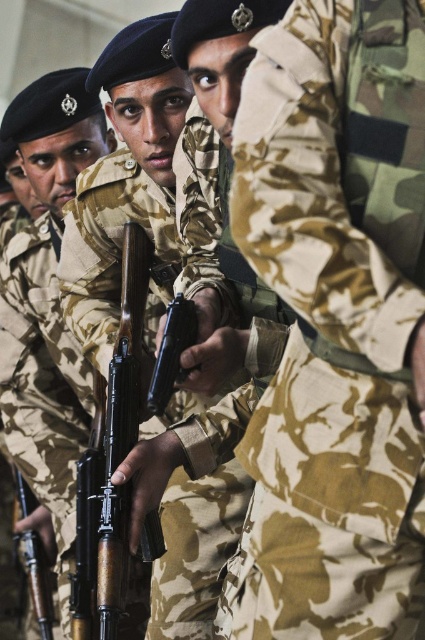
Question: Which of these objects is positioned closest to the matte brown rifle at lower left?

Choices:
 (A) camouflage fabric rifle at center
 (B) camouflage fabric uniform at center

Answer: (A)

Question: Is camouflage fabric uniform at center thinner than matte brown rifle at lower left?

Choices:
 (A) yes
 (B) no

Answer: (B)

Question: Among these objects, which one is farthest from the camera?

Choices:
 (A) camouflage fabric rifle at center
 (B) matte brown rifle at lower left

Answer: (B)

Question: Which object is positioned farthest from the camouflage fabric uniform at center?

Choices:
 (A) matte brown rifle at lower left
 (B) camouflage fabric rifle at center

Answer: (A)

Question: Does camouflage fabric uniform at center appear on the right side of camouflage fabric rifle at center?

Choices:
 (A) yes
 (B) no

Answer: (A)

Question: Is camouflage fabric rifle at center to the right of matte brown rifle at lower left from the viewer's perspective?

Choices:
 (A) yes
 (B) no

Answer: (A)